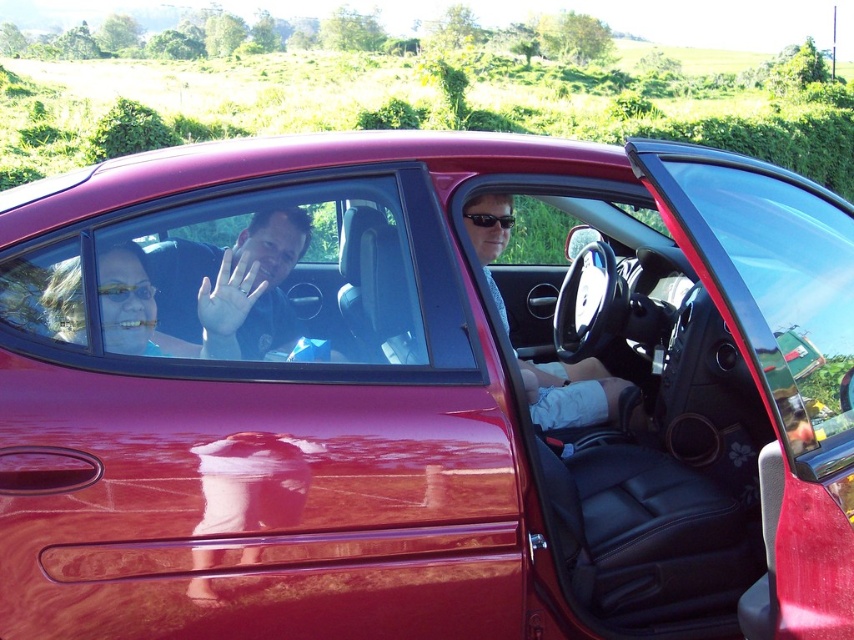
You are a photographer trying to capture a clear shot of both the matte blue shirt at center and the gold reflective goggles at center. Since the camera can only focus on one object at a time, which object should you choose to ensure the other is still in the frame?

The matte blue shirt at center might be wider than gold reflective goggles at center, so focusing on the larger object, the matte blue shirt at center, would ensure the smaller gold reflective goggles at center remains in the frame.

From the picture: You are a photographer trying to capture the matte blue shirt at center and the gold reflective goggles at center in the same frame. Based on their positions, which one is closer to the camera?

The matte blue shirt at center is above the gold reflective goggles at center, so it is closer to the camera.

Looking at this image, you are standing in front of the car and want to enter through the transparent glass door at center. Where should you look to find it?

The transparent glass door at center is located at point (x=770, y=284).